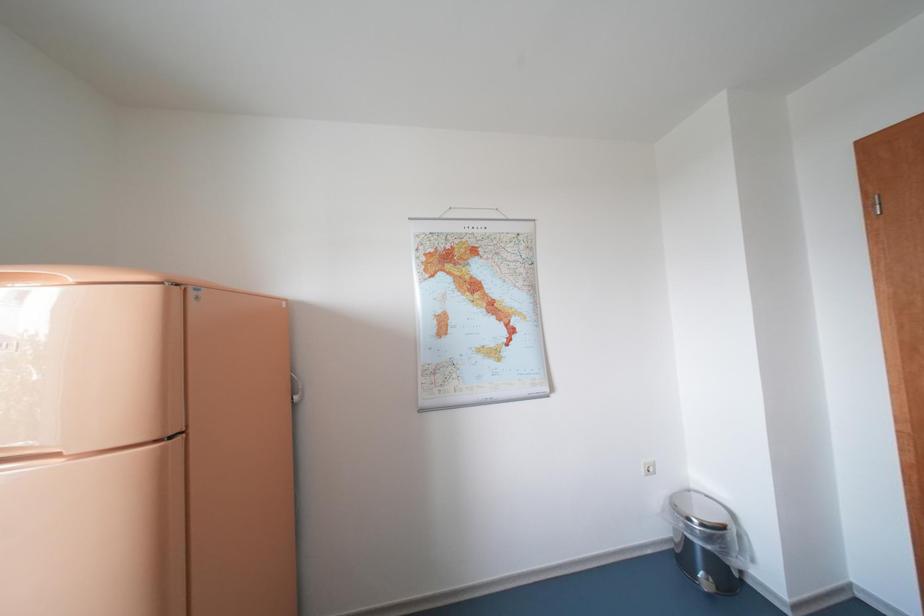
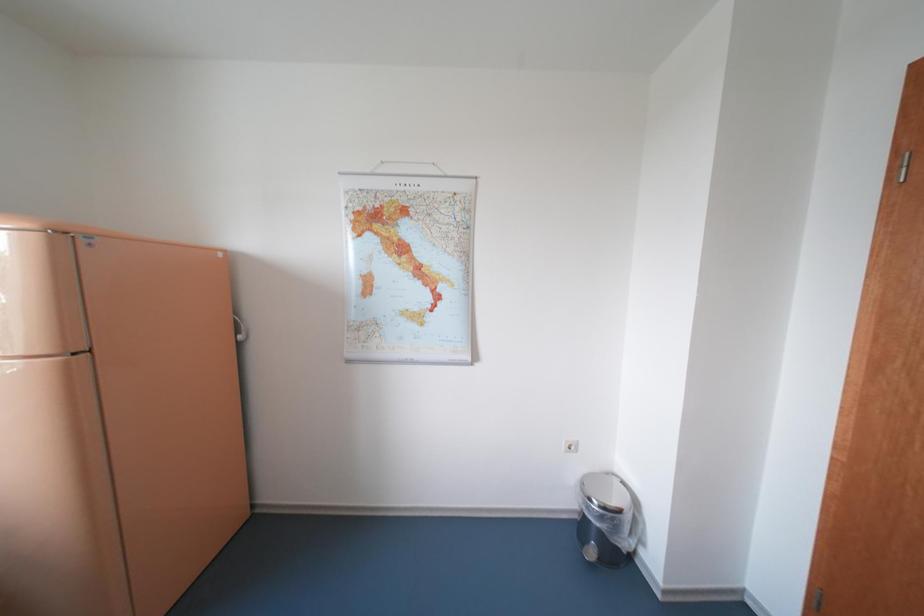
Question: What movement of the cameraman would produce the second image?

Choices:
 (A) Left
 (B) Right
 (C) Forward
 (D) Backward

Answer: (B)